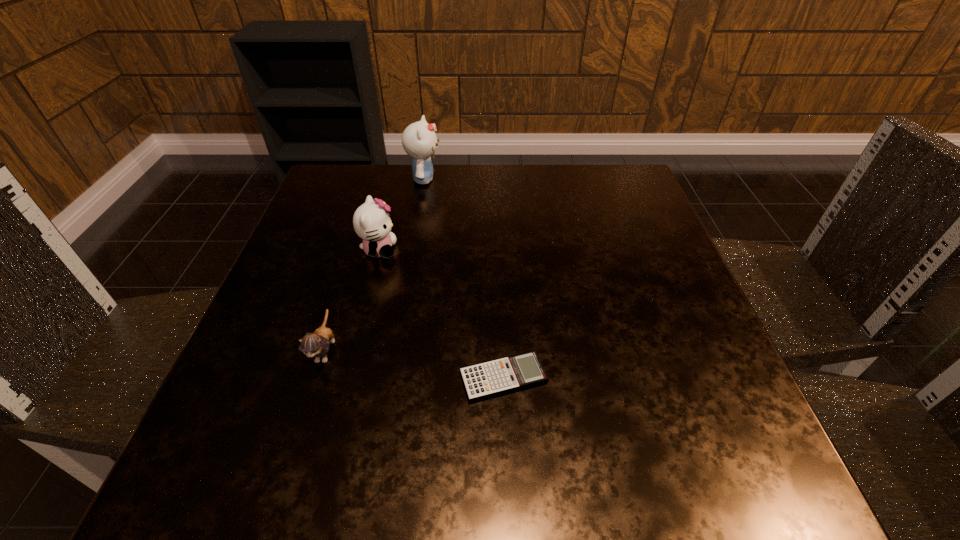
The height and width of the screenshot is (540, 960). I want to click on object that is the closest to the tallest kitten, so click(371, 222).

The height and width of the screenshot is (540, 960). What are the coordinates of `the closest kitten to the shortest kitten` in the screenshot? It's located at (371, 222).

Point out which kitten is positioned as the second nearest to the third tallest object. Please provide its 2D coordinates. Your answer should be formatted as a tuple, i.e. [(x, y)], where the tuple contains the x and y coordinates of a point satisfying the conditions above.

[(419, 140)]

Identify the location of vacant region that satisfies the following two spatial constraints: 1. on the front-facing side of the calculator; 2. on the left side of the shortest kitten. Image resolution: width=960 pixels, height=540 pixels. (317, 378).

Locate an element on the screen. blank space that satisfies the following two spatial constraints: 1. on the front-facing side of the rightmost object; 2. on the right side of the second nearest kitten is located at coordinates (347, 378).

The width and height of the screenshot is (960, 540). I want to click on free location that satisfies the following two spatial constraints: 1. on the front-facing side of the second farthest kitten; 2. on the front-facing side of the third tallest object, so click(x=353, y=350).

Identify the location of vacant region that satisfies the following two spatial constraints: 1. on the front-facing side of the second farthest kitten; 2. on the front-facing side of the nearest kitten. (353, 350).

In order to click on free location that satisfies the following two spatial constraints: 1. on the front-facing side of the rightmost object; 2. on the right side of the third tallest object in this screenshot , I will do `click(317, 378)`.

What are the coordinates of `vacant area in the image that satisfies the following two spatial constraints: 1. on the front-facing side of the calculator; 2. on the right side of the farthest object` in the screenshot? It's located at (391, 378).

Find the location of `free space that satisfies the following two spatial constraints: 1. on the front-facing side of the second shortest object; 2. on the right side of the rightmost object`. free space that satisfies the following two spatial constraints: 1. on the front-facing side of the second shortest object; 2. on the right side of the rightmost object is located at coordinates (317, 378).